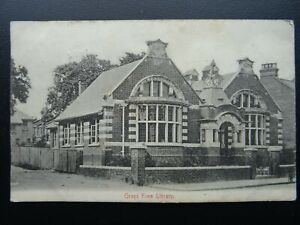
In order to click on glass in this screenshot , I will do `click(95, 131)`.